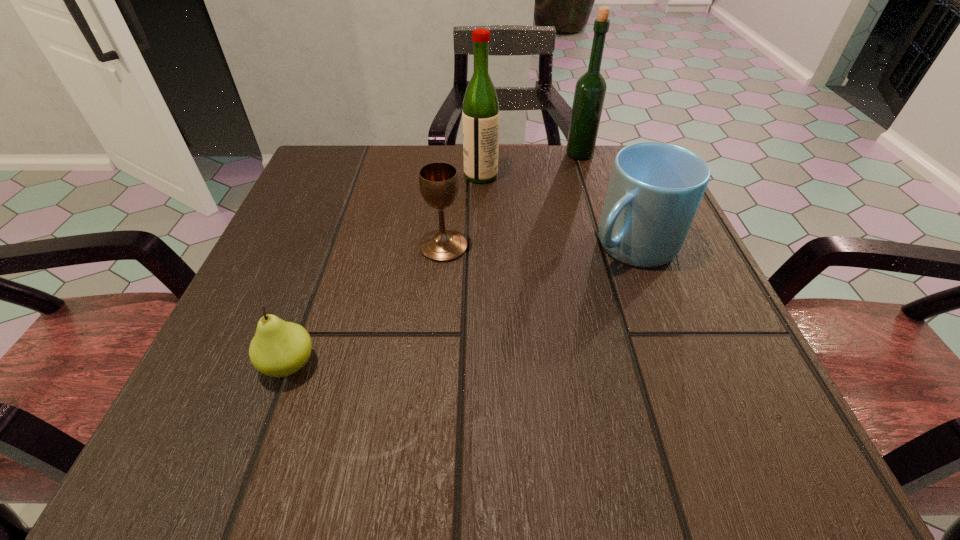
Identify the location of free space that satisfies the following two spatial constraints: 1. on the back side of the chalice; 2. on the left side of the pear. The width and height of the screenshot is (960, 540). (332, 246).

I want to click on vacant space that satisfies the following two spatial constraints: 1. on the front side of the farther liquor; 2. on the label of the fourth nearest object, so click(587, 176).

The image size is (960, 540). What are the coordinates of `free location that satisfies the following two spatial constraints: 1. on the label of the nearer liquor; 2. on the right side of the mug` in the screenshot? It's located at (481, 245).